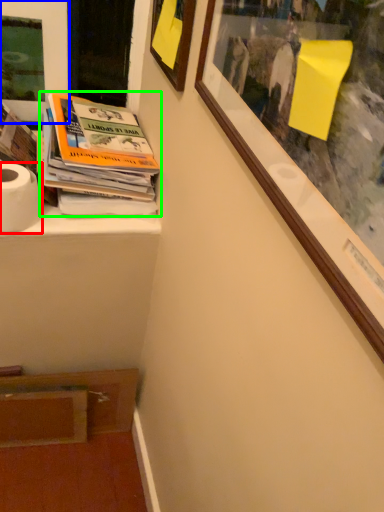
Question: Considering the real-world distances, which object is farthest from toilet paper (highlighted by a red box)? picture frame (highlighted by a blue box) or book (highlighted by a green box)?

Choices:
 (A) picture frame
 (B) book

Answer: (A)